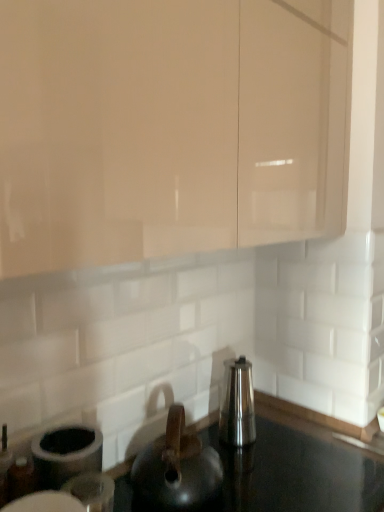
Question: Is matte black kettle at center taller or shorter than matte beige cabinet at upper center?

Choices:
 (A) tall
 (B) short

Answer: (B)

Question: Is matte black kettle at center in front of or behind matte beige cabinet at upper center in the image?

Choices:
 (A) behind
 (B) front

Answer: (A)

Question: Based on their relative distances, which object is farther from the matte beige cabinet at upper center?

Choices:
 (A) matte black kettle at center
 (B) satin silver kettle at center
 (C) black glossy countertop at center

Answer: (C)

Question: Estimate the real-world distances between objects in this image. Which object is farther from the matte black kettle at center?

Choices:
 (A) matte beige cabinet at upper center
 (B) satin silver kettle at center
 (C) black glossy countertop at center

Answer: (A)